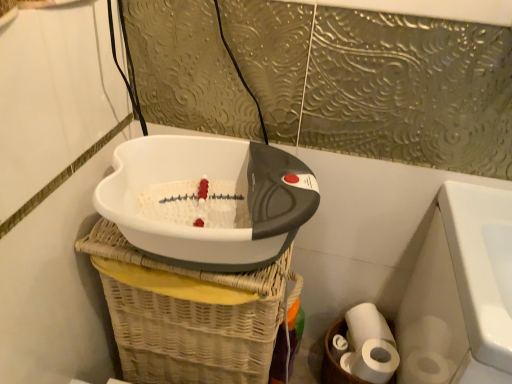
The height and width of the screenshot is (384, 512). I want to click on white plastic footbath at center, so click(x=209, y=179).

What do you see at coordinates (209, 179) in the screenshot? I see `white plastic footbath at center` at bounding box center [209, 179].

Describe the element at coordinates (370, 345) in the screenshot. I see `white matte toilet paper at lower right` at that location.

The height and width of the screenshot is (384, 512). Find the location of `white matte toilet paper at lower right`. white matte toilet paper at lower right is located at coordinates (370, 345).

I want to click on white plastic footbath at center, so click(209, 179).

In the image, is white plastic footbath at center on the left side or the right side of white matte toilet paper at lower right?

white plastic footbath at center is to the left of white matte toilet paper at lower right.

Does white plastic footbath at center come behind white matte toilet paper at lower right?

No, white plastic footbath at center is closer to the viewer.

Which is closer to the camera, [132,162] or [392,352]?

The point [132,162] is more forward.

From the image's perspective, who appears lower, white plastic footbath at center or white matte toilet paper at lower right?

white matte toilet paper at lower right, from the image's perspective.

From a real-world perspective, is white plastic footbath at center above or below white matte toilet paper at lower right?

From a real-world perspective, white plastic footbath at center is physically above white matte toilet paper at lower right.

Is white plastic footbath at center thinner than white matte toilet paper at lower right?

No.

Can you confirm if white plastic footbath at center is taller than white matte toilet paper at lower right?

No, white plastic footbath at center is not taller than white matte toilet paper at lower right.

Looking at this image, considering the sizes of objects white plastic footbath at center and white matte toilet paper at lower right in the image provided, who is smaller, white plastic footbath at center or white matte toilet paper at lower right?

white matte toilet paper at lower right.

Is white plastic footbath at center not within white matte toilet paper at lower right?

Yes, white plastic footbath at center is located beyond the bounds of white matte toilet paper at lower right.

Looking at this image, is the surface of white plastic footbath at center in direct contact with white matte toilet paper at lower right?

No.

Could you tell me if white plastic footbath at center is facing white matte toilet paper at lower right?

No, white plastic footbath at center does not turn towards white matte toilet paper at lower right.

What's the angular difference between white plastic footbath at center and white matte toilet paper at lower right's facing directions?

The angle between the facing direction of white plastic footbath at center and the facing direction of white matte toilet paper at lower right is 0.466 degrees.

How distant is white plastic footbath at center from white matte toilet paper at lower right?

white plastic footbath at center and white matte toilet paper at lower right are 20.83 inches apart.

Find the location of a particular element. This screenshot has height=384, width=512. toilet paper on the right of white plastic footbath at center is located at coordinates (370, 345).

Considering the relative positions of white matte toilet paper at lower right and white plastic footbath at center in the image provided, is white matte toilet paper at lower right to the left or to the right of white plastic footbath at center?

In the image, white matte toilet paper at lower right appears on the right side of white plastic footbath at center.

Is white matte toilet paper at lower right closer to the viewer compared to white plastic footbath at center?

No, white matte toilet paper at lower right is behind white plastic footbath at center.

Is point (387, 347) farther from viewer compared to point (164, 165)?

Yes, point (387, 347) is farther from viewer.

From the image's perspective, is white matte toilet paper at lower right on white plastic footbath at center?

No.

From a real-world perspective, is white matte toilet paper at lower right located beneath white plastic footbath at center?

Indeed, from a real-world perspective, white matte toilet paper at lower right is positioned beneath white plastic footbath at center.

Is white matte toilet paper at lower right wider or thinner than white plastic footbath at center?

In the image, white matte toilet paper at lower right appears to be more narrow than white plastic footbath at center.

Considering the relative sizes of white matte toilet paper at lower right and white plastic footbath at center in the image provided, is white matte toilet paper at lower right shorter than white plastic footbath at center?

Incorrect, the height of white matte toilet paper at lower right does not fall short of that of white plastic footbath at center.

Based on their sizes in the image, would you say white matte toilet paper at lower right is bigger or smaller than white plastic footbath at center?

Clearly, white matte toilet paper at lower right is smaller in size than white plastic footbath at center.

Does white matte toilet paper at lower right contain white plastic footbath at center?

No.

Are white matte toilet paper at lower right and white plastic footbath at center far apart?

No.

Is white matte toilet paper at lower right positioned with its back to white plastic footbath at center?

No, white matte toilet paper at lower right is not facing away from white plastic footbath at center.

How different are the orientations of white matte toilet paper at lower right and white plastic footbath at center in degrees?

The facing directions of white matte toilet paper at lower right and white plastic footbath at center are 0.466 degrees apart.

The image size is (512, 384). In the image, there is a white plastic footbath at center. Find the location of `toilet paper below it (from a real-world perspective)`. toilet paper below it (from a real-world perspective) is located at coordinates (370, 345).

Identify the location of toilet paper below the white plastic footbath at center (from a real-world perspective). (370, 345).

You are a GUI agent. You are given a task and a screenshot of the screen. Output one action in this format:
    pyautogui.click(x=<x>, y=<y>)
    Task: Click on the appliance on the left of white matte toilet paper at lower right
    This screenshot has width=512, height=384.
    Given the screenshot: What is the action you would take?
    pyautogui.click(x=209, y=179)